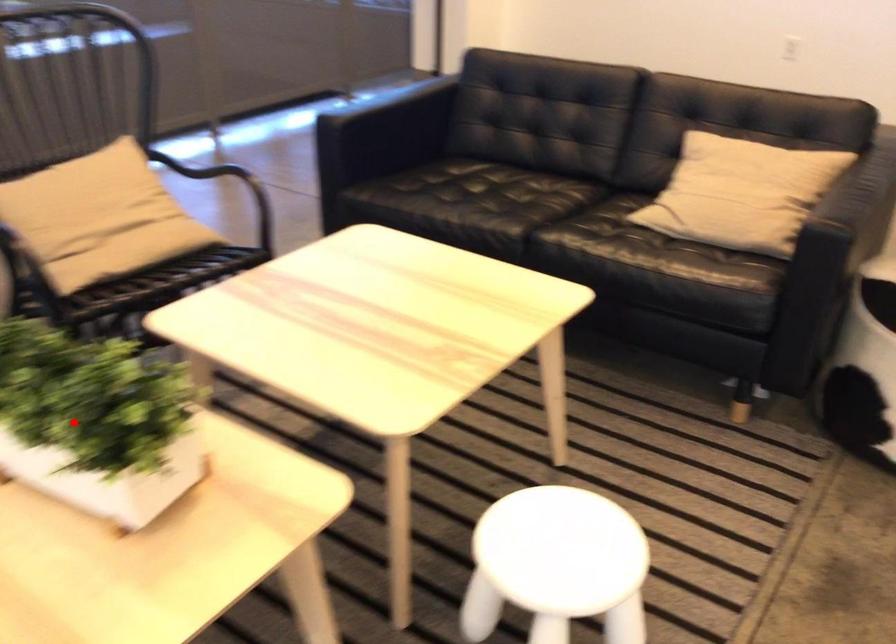
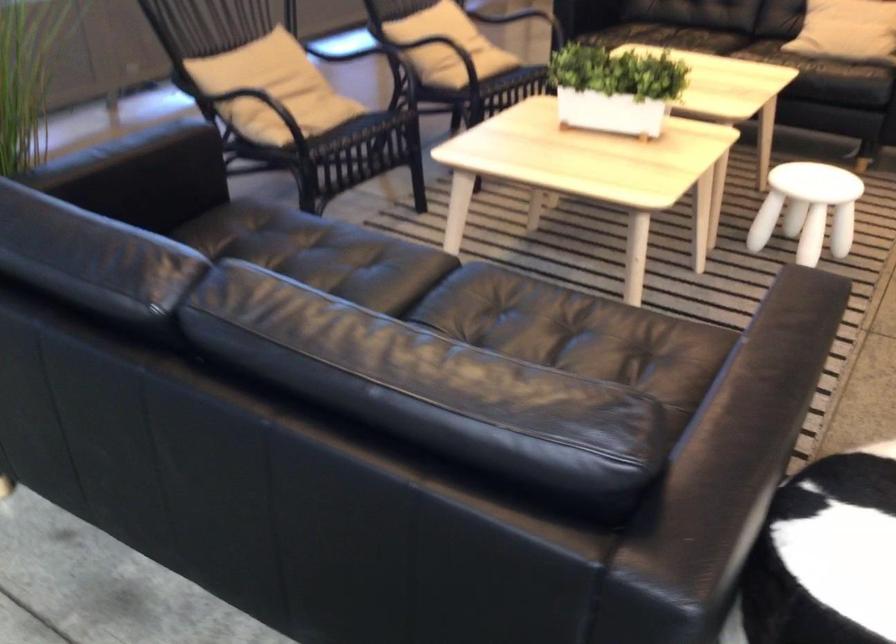
Question: I am providing you with two images of the same scene from different viewpoints. A red point is marked on the first image. At the location where the point appears in image 1, is it still visible in image 2?

Choices:
 (A) Yes
 (B) No

Answer: (A)